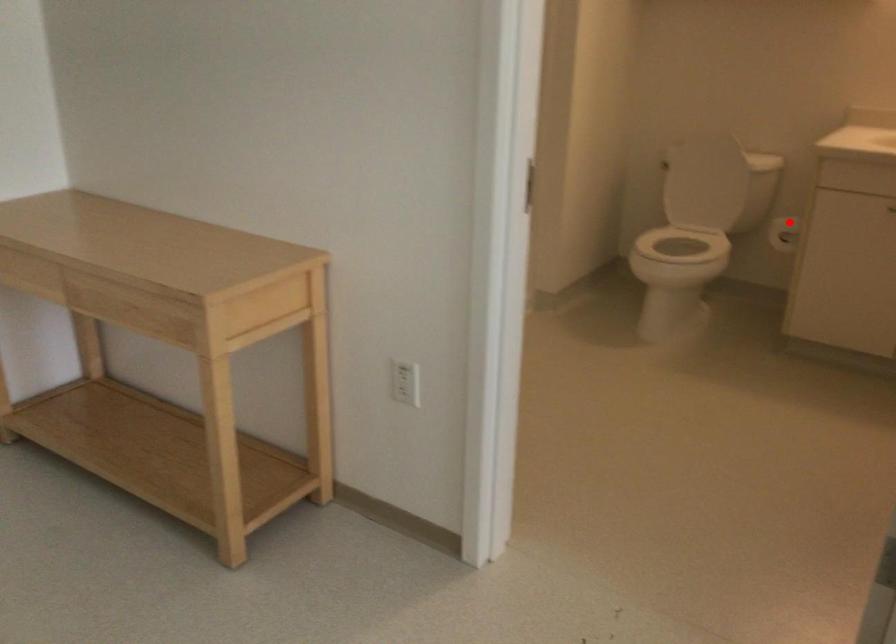
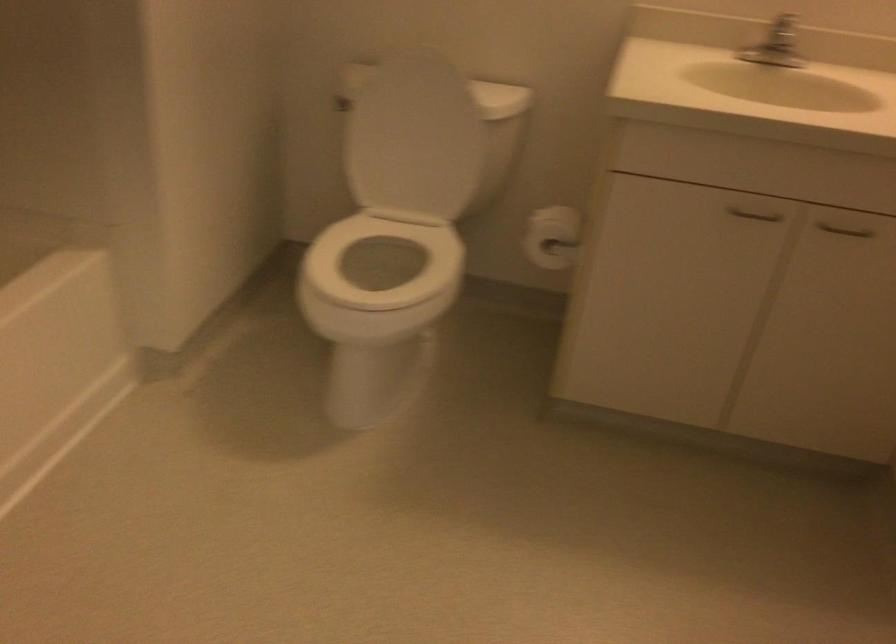
Question: A red point is marked in image1. In image2, is the corresponding 3D point closer to the camera or farther? Reply with the corresponding letter.

Choices:
 (A) The corresponding 3D point is closer.
 (B) The corresponding 3D point is farther.

Answer: (A)